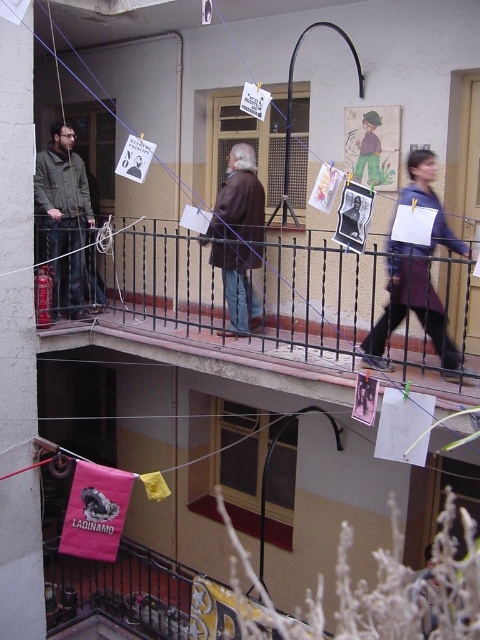
Question: Among these objects, which one is nearest to the camera?

Choices:
 (A) brown leather jacket at center
 (B) smooth brown coat at center
 (C) purple fabric dress at center
 (D) brown paper bag at center

Answer: (C)

Question: Is the position of metallic balcony at center less distant than that of smooth brown coat at center?

Choices:
 (A) yes
 (B) no

Answer: (B)

Question: Is metallic balcony at center below purple fabric dress at center?

Choices:
 (A) yes
 (B) no

Answer: (A)

Question: Which object is positioned closest to the matte black jacket at left?

Choices:
 (A) brown paper bag at center
 (B) smooth brown coat at center

Answer: (A)

Question: Which point is farther from the camera taking this photo?

Choices:
 (A) (405, 304)
 (B) (300, 324)

Answer: (B)

Question: Can you confirm if brown leather jacket at center is positioned below smooth brown coat at center?

Choices:
 (A) no
 (B) yes

Answer: (A)